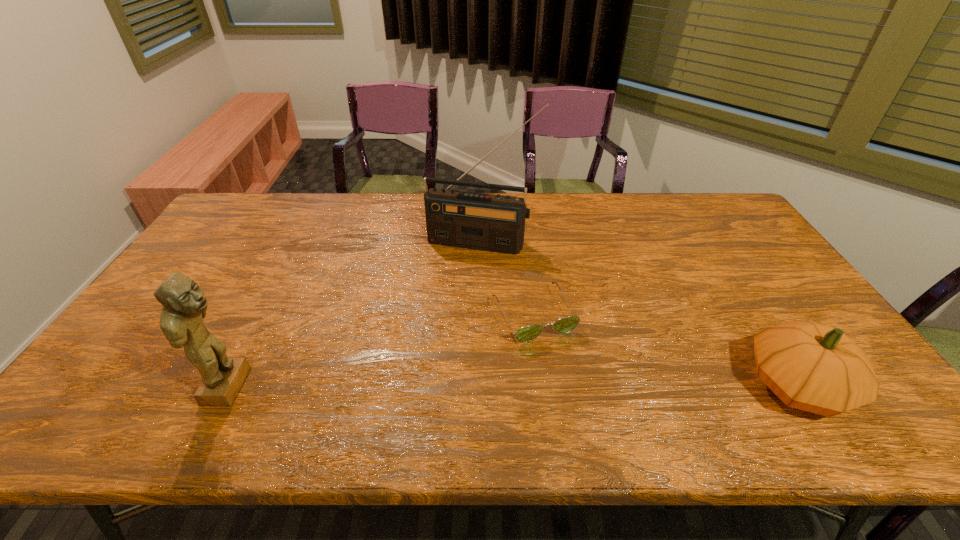
This screenshot has height=540, width=960. I want to click on vacant space at the near edge, so click(x=664, y=383).

This screenshot has width=960, height=540. I want to click on vacant space at the left edge of the desktop, so click(149, 360).

At what (x,y) coordinates should I click in order to perform the action: click on vacant space at the right edge of the desktop. Please return your answer as a coordinate pair (x, y). The width and height of the screenshot is (960, 540). Looking at the image, I should click on (767, 262).

The image size is (960, 540). What are the coordinates of `free spot at the near left corner of the desktop` in the screenshot? It's located at (86, 393).

I want to click on vacant area that lies between the shortest object and the third shortest object, so [382, 350].

Locate an element on the screen. This screenshot has width=960, height=540. free space between the leftmost object and the radio receiver is located at coordinates (355, 314).

The width and height of the screenshot is (960, 540). What are the coordinates of `free spot between the shortest object and the second shortest object` in the screenshot? It's located at (665, 350).

What are the coordinates of `free space that is in between the farthest object and the third nearest object` in the screenshot? It's located at (508, 278).

You are a GUI agent. You are given a task and a screenshot of the screen. Output one action in this format:
    pyautogui.click(x=<x>, y=<y>)
    Task: Click on the empty space between the radio receiver and the third shortest object
    This screenshot has height=540, width=960.
    Given the screenshot: What is the action you would take?
    pyautogui.click(x=355, y=314)

You are a GUI agent. You are given a task and a screenshot of the screen. Output one action in this format:
    pyautogui.click(x=<x>, y=<y>)
    Task: Click on the free area in between the radio receiver and the rightmost object
    This screenshot has width=960, height=540.
    Given the screenshot: What is the action you would take?
    pyautogui.click(x=639, y=314)